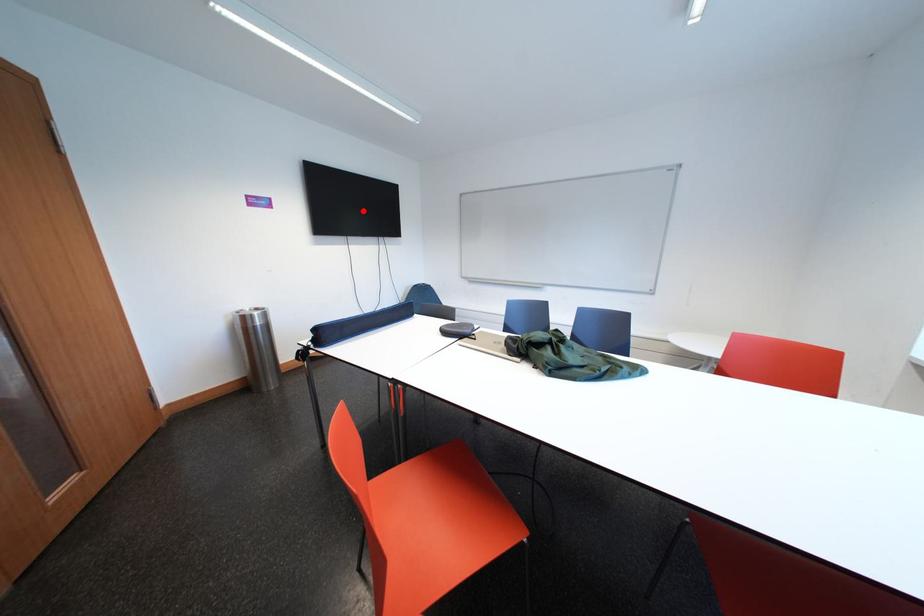
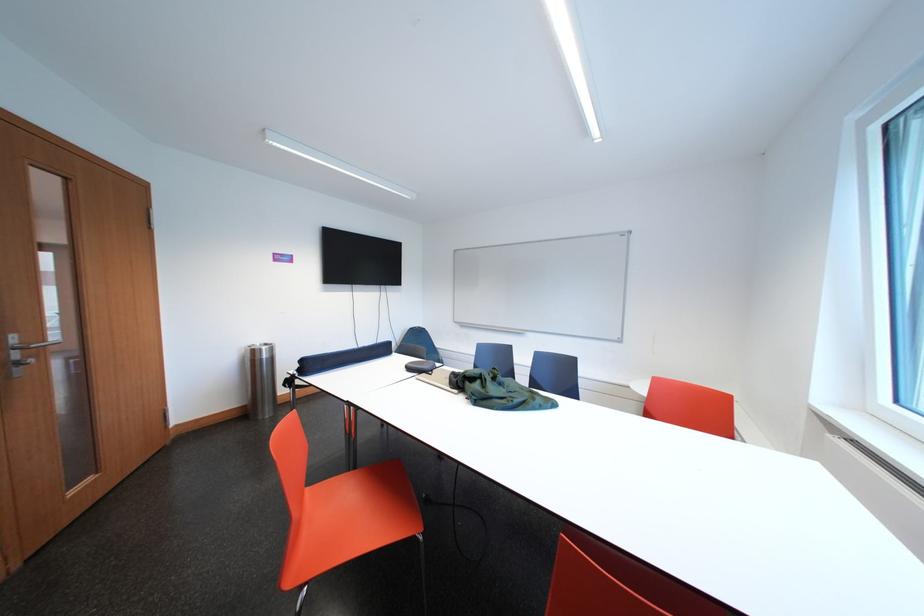
The point at the highlighted location is marked in the first image. Where is the corresponding point in the second image?

(371, 265)